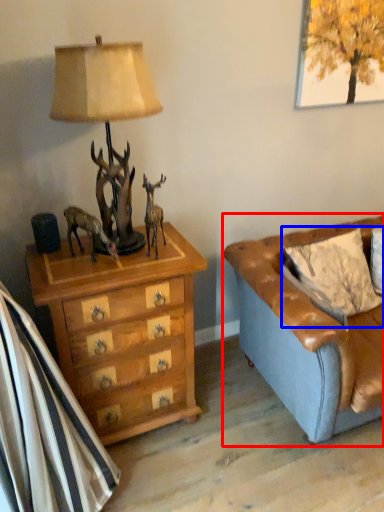
Question: Which of the following is the farthest to the observer, studio couch (highlighted by a red box) or pillow (highlighted by a blue box)?

Choices:
 (A) studio couch
 (B) pillow

Answer: (B)